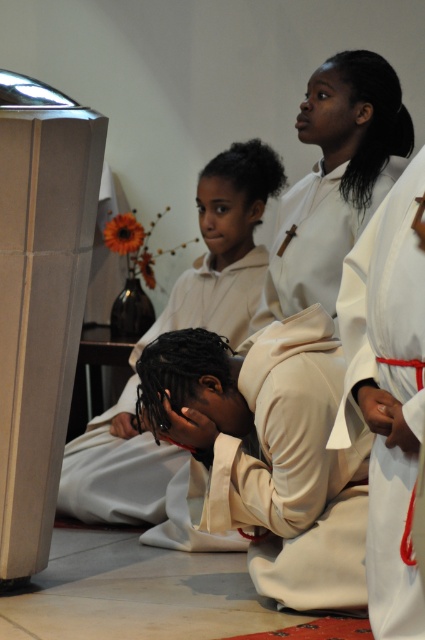
Does point (385, 339) come farther from viewer compared to point (138, 500)?

No, (385, 339) is in front of (138, 500).

Does white matte robe at center have a lesser width compared to white matte robe at lower center?

Yes.

Between point (397, 561) and point (158, 330), which one is positioned behind?

Point (158, 330)

Image resolution: width=425 pixels, height=640 pixels. In order to click on white matte robe at center in this screenshot , I will do `click(387, 392)`.

Which is in front, point (187, 356) or point (125, 384)?

Point (187, 356) is in front.

The image size is (425, 640). Describe the element at coordinates (269, 452) in the screenshot. I see `white matte/soft preacher at lower center` at that location.

Is point (221, 508) positioned after point (141, 449)?

No.

This screenshot has width=425, height=640. I want to click on white matte/soft preacher at lower center, so click(269, 452).

Is point (223, 289) farther from viewer compared to point (178, 333)?

Yes, it is.

This screenshot has height=640, width=425. I want to click on white matte robe at lower center, so click(x=116, y=470).